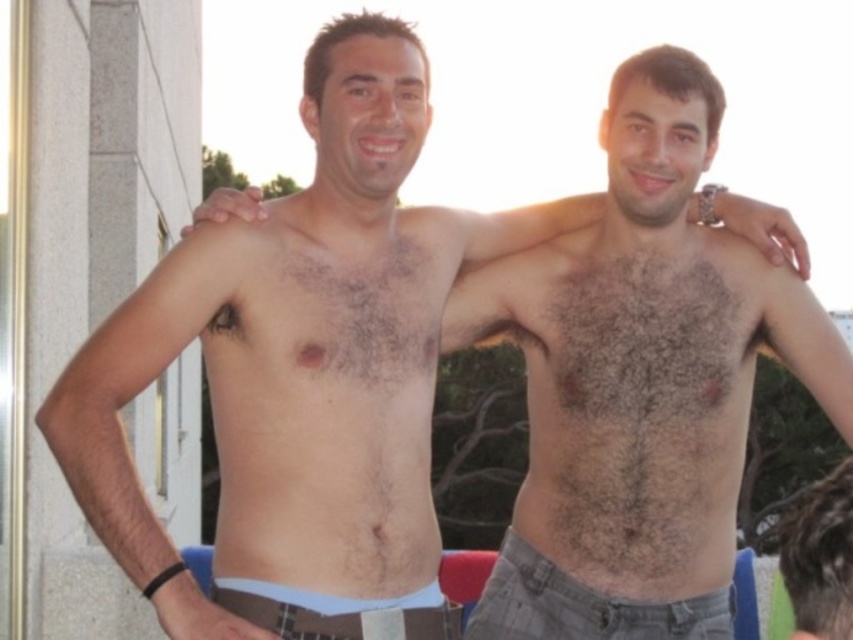
You are a photographer trying to capture a closeup of both the dark brown hairy chest at center and the brown hair at upper right in the scene. Based on their sizes, which one would appear larger in your photo?

The dark brown hairy chest at center would appear larger in the photo because it is much taller than the brown hair at upper right.

You are a photographer setting up a shot of the two men. You need to position a light source to the left of the white fabric shorts at lower center but to the right of the white concrete pillar at left. Is this possible?

The white concrete pillar at left is to the left of the white fabric shorts at lower center, so placing the light source between them is possible as there is space between the two objects.